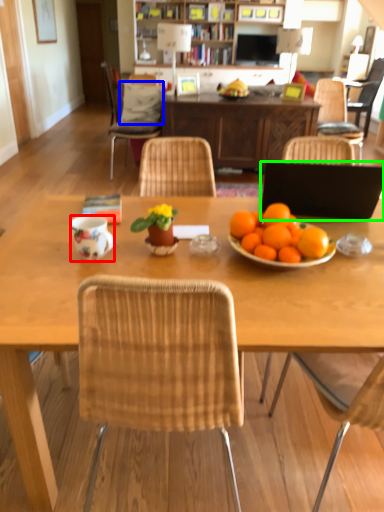
Question: Which object is positioned closest to coffee cup (highlighted by a red box)? Select from pillow (highlighted by a blue box) and laptop (highlighted by a green box).

Choices:
 (A) pillow
 (B) laptop

Answer: (B)